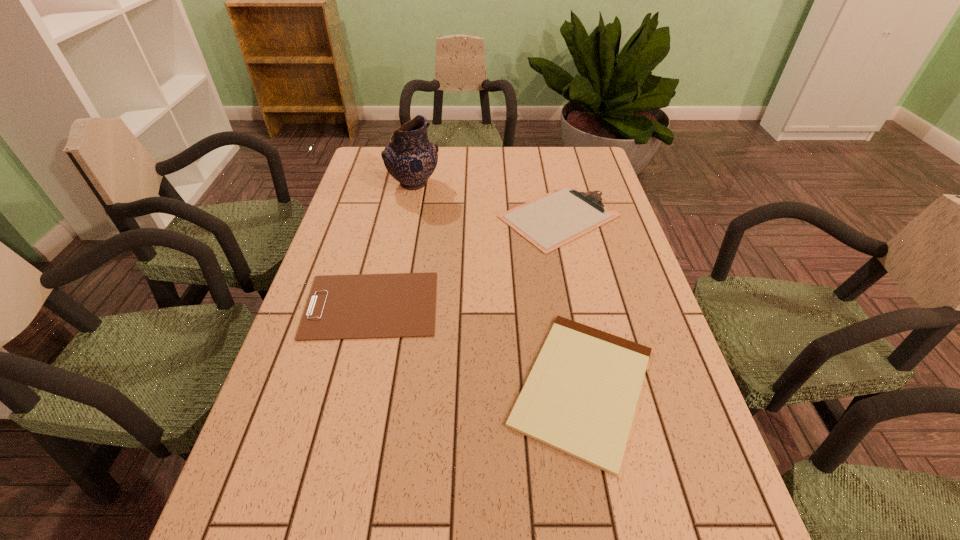
Locate an element on the screen. The height and width of the screenshot is (540, 960). vacant space in between the second tallest clipboard and the third shortest object is located at coordinates [466, 260].

Find the location of a particular element. The height and width of the screenshot is (540, 960). vacant space in between the leftmost clipboard and the farthest clipboard is located at coordinates (466, 260).

Locate an element on the screen. The width and height of the screenshot is (960, 540). free space between the pottery and the second shortest clipboard is located at coordinates (393, 244).

You are a GUI agent. You are given a task and a screenshot of the screen. Output one action in this format:
    pyautogui.click(x=<x>, y=<y>)
    Task: Click on the vacant space that is in between the second shortest object and the tallest object
    The image size is (960, 540).
    Given the screenshot: What is the action you would take?
    pyautogui.click(x=393, y=244)

At what (x,y) coordinates should I click in order to perform the action: click on vacant area that lies between the shortest clipboard and the tallest clipboard. Please return your answer as a coordinate pair (x, y). Looking at the image, I should click on (571, 301).

You are a GUI agent. You are given a task and a screenshot of the screen. Output one action in this format:
    pyautogui.click(x=<x>, y=<y>)
    Task: Click on the free space between the second shortest object and the pottery
    
    Given the screenshot: What is the action you would take?
    pyautogui.click(x=393, y=244)

Where is `free space between the tallest clipboard and the shortest object`? free space between the tallest clipboard and the shortest object is located at coordinates (571, 301).

Image resolution: width=960 pixels, height=540 pixels. In order to click on free space between the tallest object and the tallest clipboard in this screenshot , I will do `click(487, 200)`.

Where is `object that is the second closest to the third tallest object`? Image resolution: width=960 pixels, height=540 pixels. object that is the second closest to the third tallest object is located at coordinates (550, 221).

Identify the location of the second closest object to the tallest clipboard. This screenshot has width=960, height=540. (410, 157).